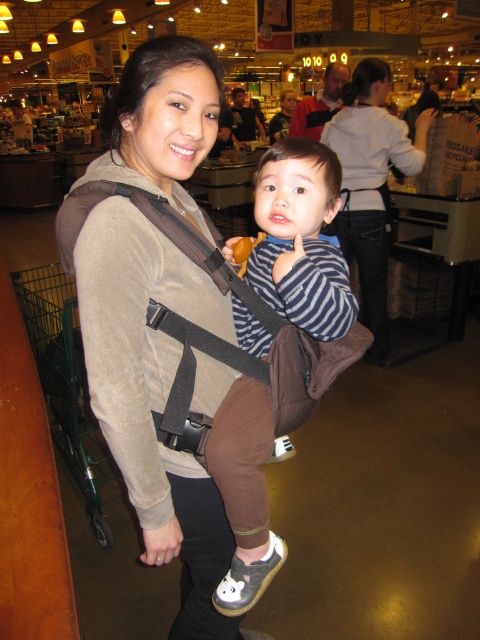
Which is above, brown fabric baby carrier at center or white hoodie at center?

white hoodie at center is above.

Does point (149, 513) come in front of point (384, 340)?

Yes.

At what (x,y) coordinates should I click in order to perform the action: click on brown fabric baby carrier at center. Please return your answer as a coordinate pair (x, y). Looking at the image, I should click on (158, 321).

Which is more to the left, striped fabric shirt at center or white hoodie at center?

striped fabric shirt at center

Who is more forward, [219,483] or [369,275]?

Positioned in front is point [219,483].

Locate an element on the screen. This screenshot has height=640, width=480. striped fabric shirt at center is located at coordinates (300, 240).

Between brown fabric baby carrier at center and striped fabric shirt at center, which one appears on the right side from the viewer's perspective?

striped fabric shirt at center

Can you confirm if brown fabric baby carrier at center is wider than striped fabric shirt at center?

Indeed, brown fabric baby carrier at center has a greater width compared to striped fabric shirt at center.

Which is in front, point (166, 388) or point (348, 316)?

Point (348, 316) is more forward.

Locate an element on the screen. The image size is (480, 640). brown fabric baby carrier at center is located at coordinates (158, 321).